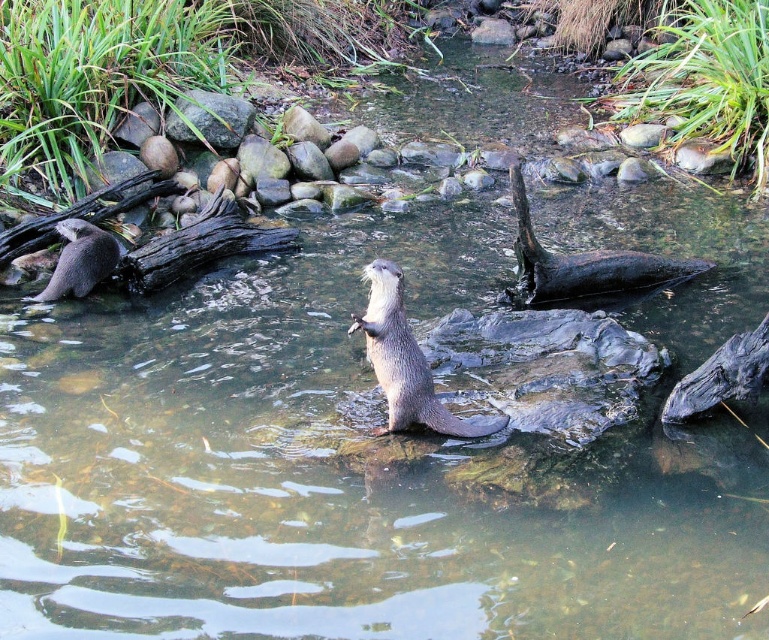
You are an otter observer trying to locate the gray fur otter at center in the image. What are the coordinates of its position?

The gray fur otter at center is located at coordinates (404, 360).

You are a photographer trying to capture the black smooth log at center in the image. The camera is set to focus on the point at coordinates point (583, 264). Will this point be on the black smooth log at center?

Yes, because the point (583, 264) corresponds to the black smooth log at center.